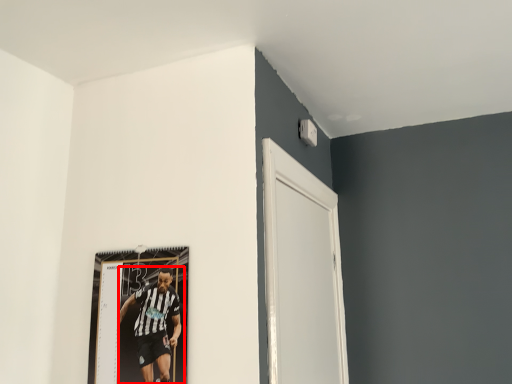
Question: In this image, where is person (annotated by the red box) located relative to door?

Choices:
 (A) left
 (B) right

Answer: (A)